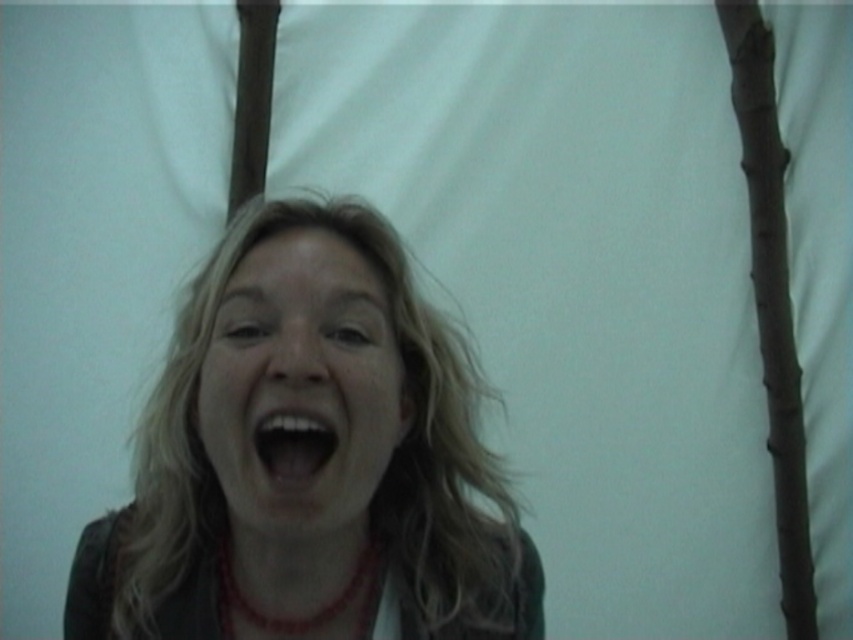
Identify the location of smooth skin face at center. 300,388.

Does smooth skin face at center appear over red beaded necklace at center?

Yes, smooth skin face at center is above red beaded necklace at center.

Locate an element on the screen. smooth skin face at center is located at coordinates (300, 388).

Can you confirm if matte brown hair at center is positioned above smooth skin face at center?

Actually, matte brown hair at center is below smooth skin face at center.

Looking at this image, can you confirm if matte brown hair at center is smaller than smooth skin face at center?

No.

Which is behind, point (463, 605) or point (222, 380)?

The point (463, 605) is behind.

Where is `matte brown hair at center`? matte brown hair at center is located at coordinates (317, 472).

Is point (294, 346) closer to viewer compared to point (299, 416)?

No, it is behind (299, 416).

Image resolution: width=853 pixels, height=640 pixels. Find the location of `matte brown hair at center`. matte brown hair at center is located at coordinates (317, 472).